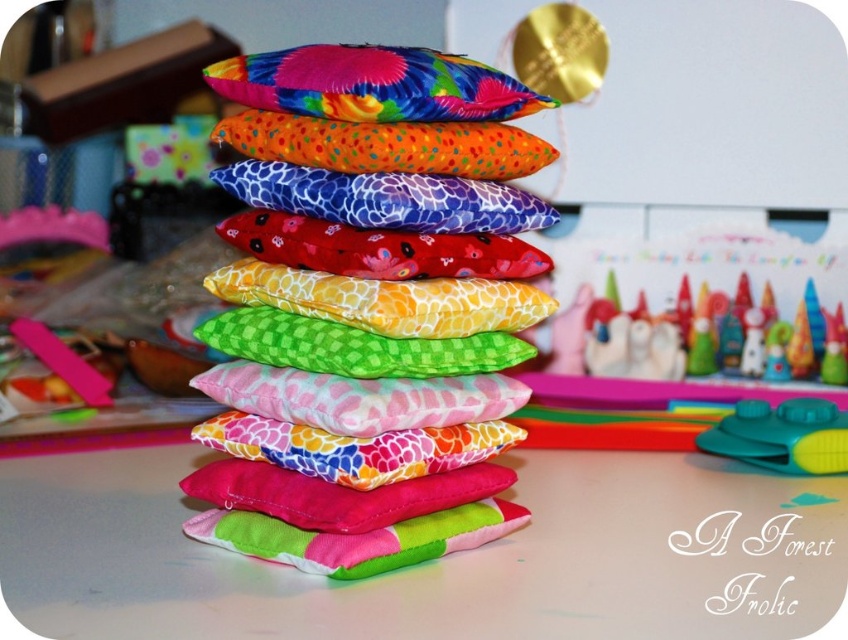
Question: Does vibrant fabric pillows at center appear over multicolored fabric pillow at upper center?

Choices:
 (A) no
 (B) yes

Answer: (A)

Question: Can you confirm if vibrant fabric pillows at center is positioned to the left of multicolored fabric pillow at upper center?

Choices:
 (A) yes
 (B) no

Answer: (A)

Question: Which object is farther from the camera taking this photo?

Choices:
 (A) multicolored fabric pillow at upper center
 (B) vibrant fabric pillows at center

Answer: (B)

Question: Can you confirm if vibrant fabric pillows at center is bigger than multicolored fabric pillow at upper center?

Choices:
 (A) no
 (B) yes

Answer: (B)

Question: Among these points, which one is nearest to the camera?

Choices:
 (A) (298, 456)
 (B) (406, 83)

Answer: (B)